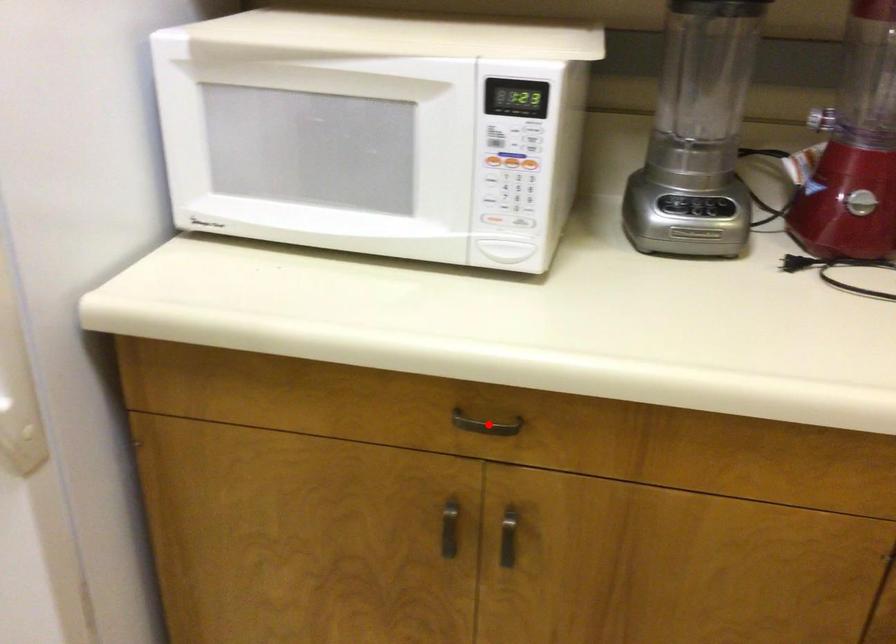
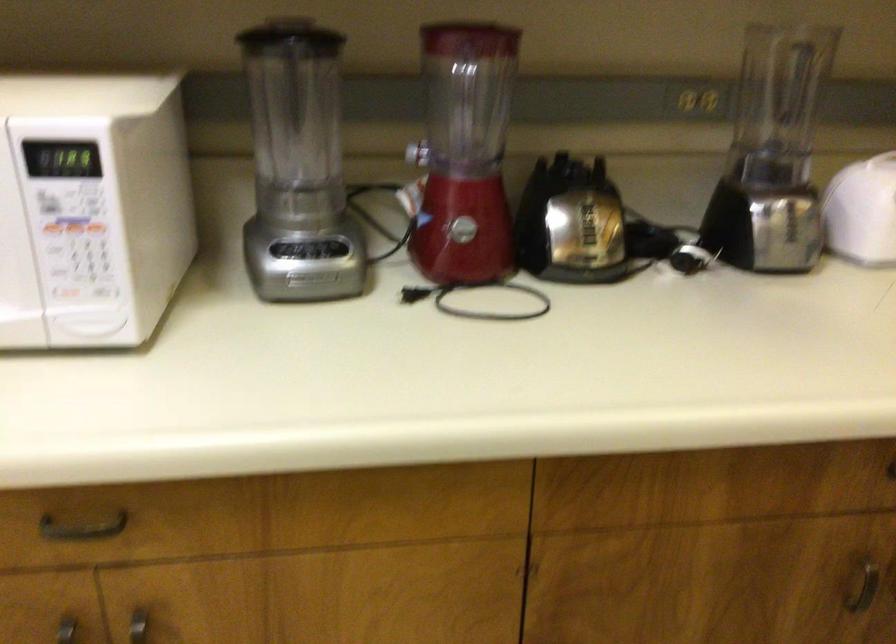
Locate, in the second image, the point that corresponds to the highlighted location in the first image.

(82, 527)